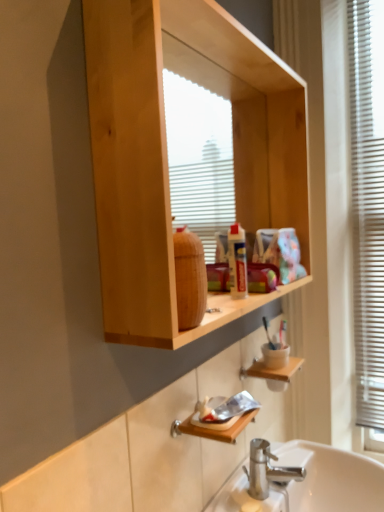
Question: From the image's perspective, does white plastic blinds at right appear lower than natural wood cabinet at upper center?

Choices:
 (A) no
 (B) yes

Answer: (B)

Question: From a real-world perspective, is white plastic blinds at right below natural wood cabinet at upper center?

Choices:
 (A) yes
 (B) no

Answer: (A)

Question: Considering the relative sizes of white plastic blinds at right and natural wood cabinet at upper center in the image provided, is white plastic blinds at right thinner than natural wood cabinet at upper center?

Choices:
 (A) no
 (B) yes

Answer: (B)

Question: Can you confirm if white plastic blinds at right is bigger than natural wood cabinet at upper center?

Choices:
 (A) yes
 (B) no

Answer: (B)

Question: Is white plastic blinds at right in front of natural wood cabinet at upper center?

Choices:
 (A) no
 (B) yes

Answer: (A)

Question: From a real-world perspective, relative to natural wood cabinet at upper center, is wooden shelf at lower center vertically above or below?

Choices:
 (A) below
 (B) above

Answer: (A)

Question: In terms of width, does wooden shelf at lower center look wider or thinner when compared to natural wood cabinet at upper center?

Choices:
 (A) wide
 (B) thin

Answer: (A)

Question: Considering the positions of wooden shelf at lower center and natural wood cabinet at upper center in the image, is wooden shelf at lower center bigger or smaller than natural wood cabinet at upper center?

Choices:
 (A) big
 (B) small

Answer: (B)

Question: Is wooden shelf at lower center in front of or behind natural wood cabinet at upper center in the image?

Choices:
 (A) behind
 (B) front

Answer: (A)

Question: From the image's perspective, is white plastic blinds at right positioned above or below wooden shelf at lower center?

Choices:
 (A) above
 (B) below

Answer: (A)

Question: From a real-world perspective, is white plastic blinds at right positioned above or below wooden shelf at lower center?

Choices:
 (A) below
 (B) above

Answer: (B)

Question: Is white plastic blinds at right to the left or to the right of wooden shelf at lower center in the image?

Choices:
 (A) left
 (B) right

Answer: (B)

Question: In the image, is white plastic blinds at right positioned in front of or behind wooden shelf at lower center?

Choices:
 (A) front
 (B) behind

Answer: (B)

Question: Considering the positions of natural wood cabinet at upper center and wooden shelf at lower center in the image, is natural wood cabinet at upper center taller or shorter than wooden shelf at lower center?

Choices:
 (A) tall
 (B) short

Answer: (A)

Question: From a real-world perspective, relative to wooden shelf at lower center, is natural wood cabinet at upper center vertically above or below?

Choices:
 (A) below
 (B) above

Answer: (B)